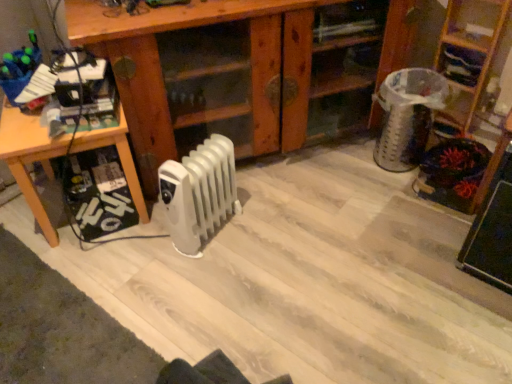
Question: Considering the relative positions of wooden bookshelf at upper right, the first shelf from the right, and white plastic radiator at center in the image provided, is wooden bookshelf at upper right, the first shelf from the right, to the right of white plastic radiator at center from the viewer's perspective?

Choices:
 (A) no
 (B) yes

Answer: (B)

Question: Is wooden bookshelf at upper right, the third shelf from the left, taller than white plastic radiator at center?

Choices:
 (A) yes
 (B) no

Answer: (A)

Question: From the image's perspective, is wooden bookshelf at upper right, the first shelf from the right, beneath white plastic radiator at center?

Choices:
 (A) yes
 (B) no

Answer: (B)

Question: From the image's perspective, is wooden bookshelf at upper right, the third shelf from the left, above white plastic radiator at center?

Choices:
 (A) no
 (B) yes

Answer: (B)

Question: Is wooden bookshelf at upper right, the first shelf from the right, oriented towards white plastic radiator at center?

Choices:
 (A) yes
 (B) no

Answer: (B)

Question: From a real-world perspective, is wooden bookshelf at upper right, the first shelf from the right, over white plastic radiator at center?

Choices:
 (A) no
 (B) yes

Answer: (B)

Question: Are wooden cabinet at center, the 3th shelf positioned from the right, and wooden bookshelf at upper right, the first shelf from the right, located far from each other?

Choices:
 (A) no
 (B) yes

Answer: (A)

Question: Is wooden cabinet at center, acting as the 1th shelf starting from the left, positioned before wooden bookshelf at upper right, the first shelf from the right?

Choices:
 (A) yes
 (B) no

Answer: (A)

Question: Can you confirm if wooden cabinet at center, the 3th shelf positioned from the right, is smaller than wooden bookshelf at upper right, the first shelf from the right?

Choices:
 (A) yes
 (B) no

Answer: (B)

Question: Does wooden cabinet at center, the 3th shelf positioned from the right, have a lesser height compared to wooden bookshelf at upper right, the third shelf from the left?

Choices:
 (A) yes
 (B) no

Answer: (B)

Question: Is wooden cabinet at center, acting as the 1th shelf starting from the left, located outside wooden bookshelf at upper right, the third shelf from the left?

Choices:
 (A) no
 (B) yes

Answer: (B)

Question: Does wooden cabinet at center, acting as the 1th shelf starting from the left, have a larger size compared to wooden bookshelf at upper right, the third shelf from the left?

Choices:
 (A) no
 (B) yes

Answer: (B)

Question: From the image's perspective, would you say wooden table at left is shown under wooden bookshelf at upper right, which is counted as the second shelf, starting from the right?

Choices:
 (A) no
 (B) yes

Answer: (B)